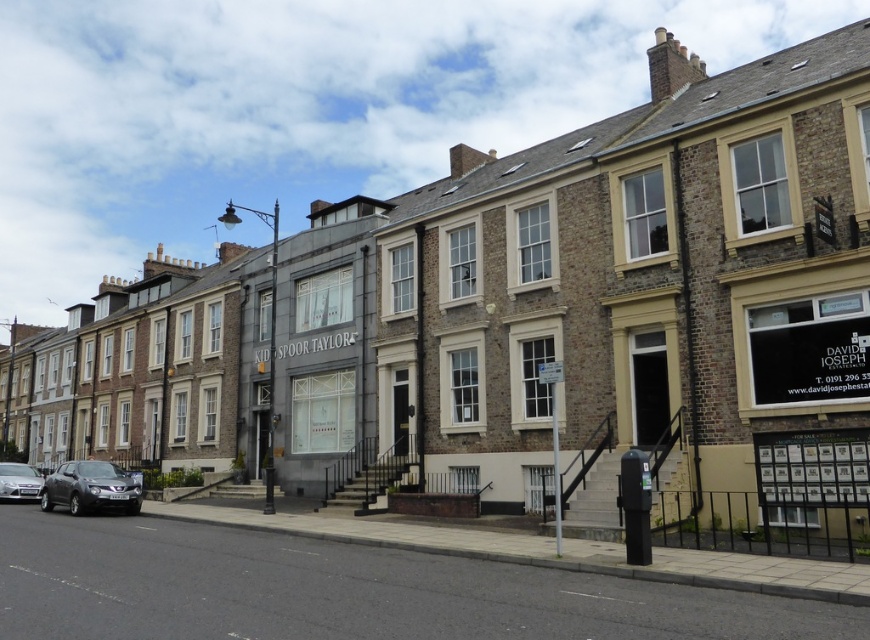
Question: Which point appears closest to the camera in this image?

Choices:
 (A) (15, 465)
 (B) (111, 476)

Answer: (B)

Question: Which object is farther from the camera taking this photo?

Choices:
 (A) silver metallic car at lower left
 (B) matte black suv at lower left

Answer: (A)

Question: Does matte black suv at lower left appear on the right side of silver metallic car at lower left?

Choices:
 (A) no
 (B) yes

Answer: (B)

Question: Is matte black suv at lower left positioned in front of silver metallic car at lower left?

Choices:
 (A) no
 (B) yes

Answer: (B)

Question: Can you confirm if matte black suv at lower left is wider than silver metallic car at lower left?

Choices:
 (A) no
 (B) yes

Answer: (B)